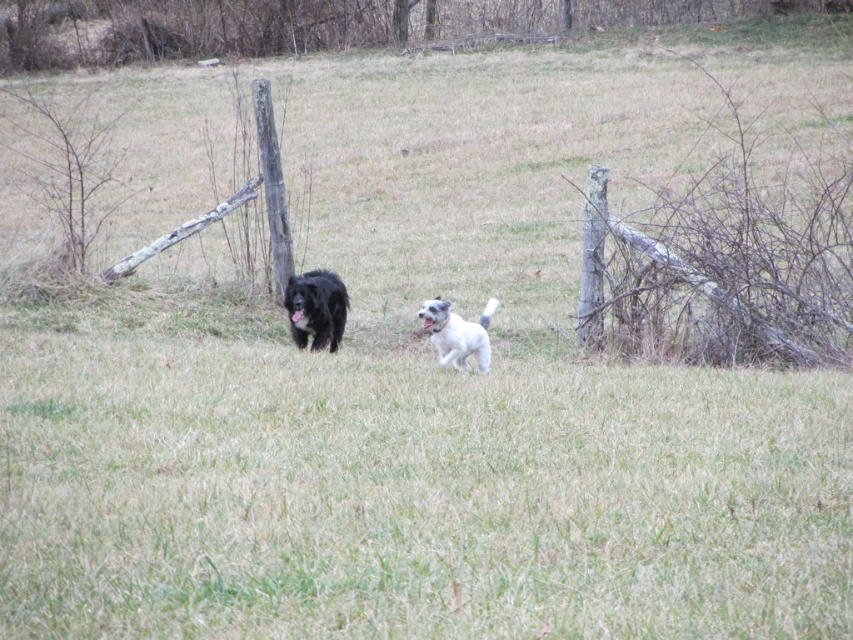
Looking at this image, you are a photographer setting up a tripod to capture both the black fluffy dog at center and the white fluffy dog at center in the same frame. Based on their sizes, which dog should you position closer to the tripod to ensure both appear similarly sized in the photo?

The black fluffy dog at center is taller than the white fluffy dog at center. To make them appear similarly sized in the photo, position the white fluffy dog at center closer to the tripod since it is smaller and needs to be nearer to match the size of the taller black fluffy dog at center in the frame.